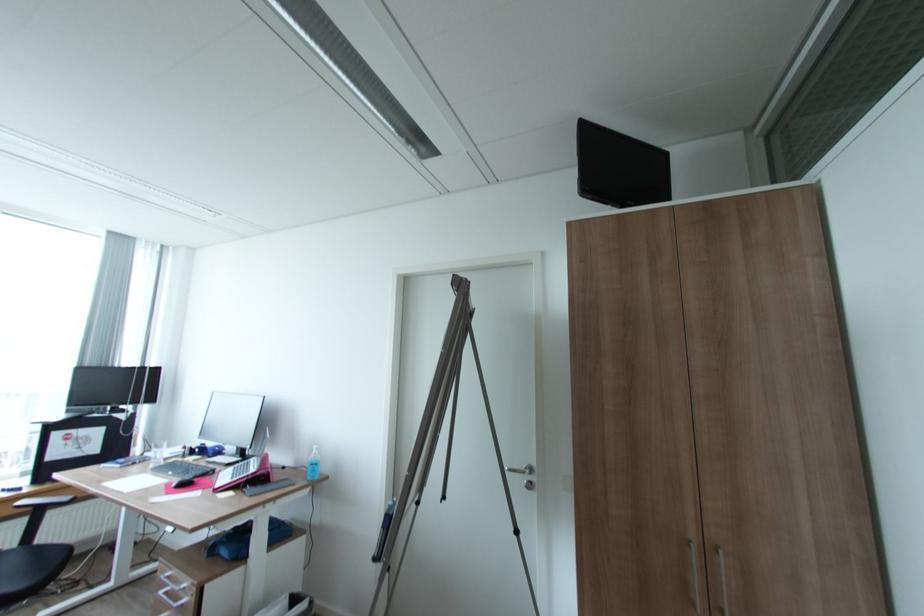
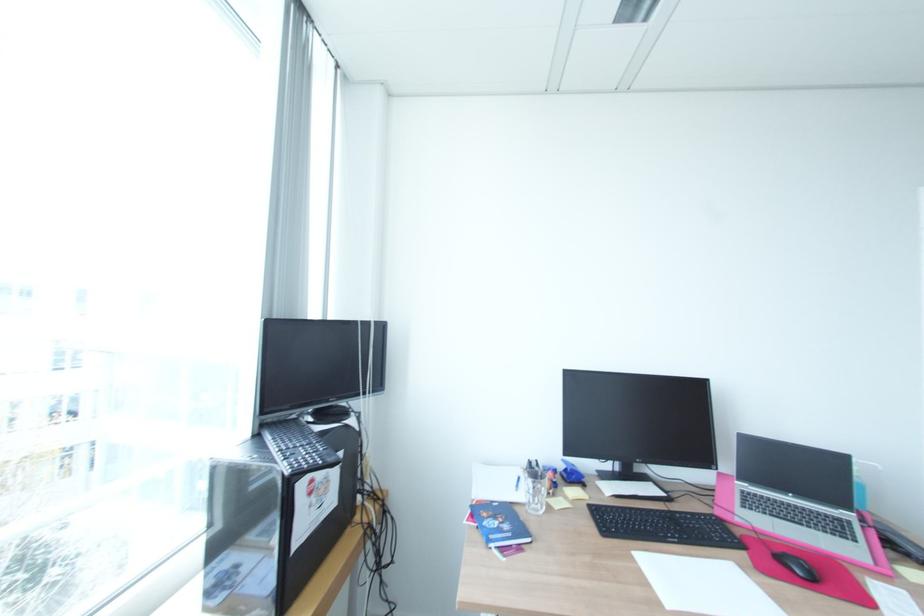
Find the pixel in the second image that matches (155,367) in the first image.

(381, 321)